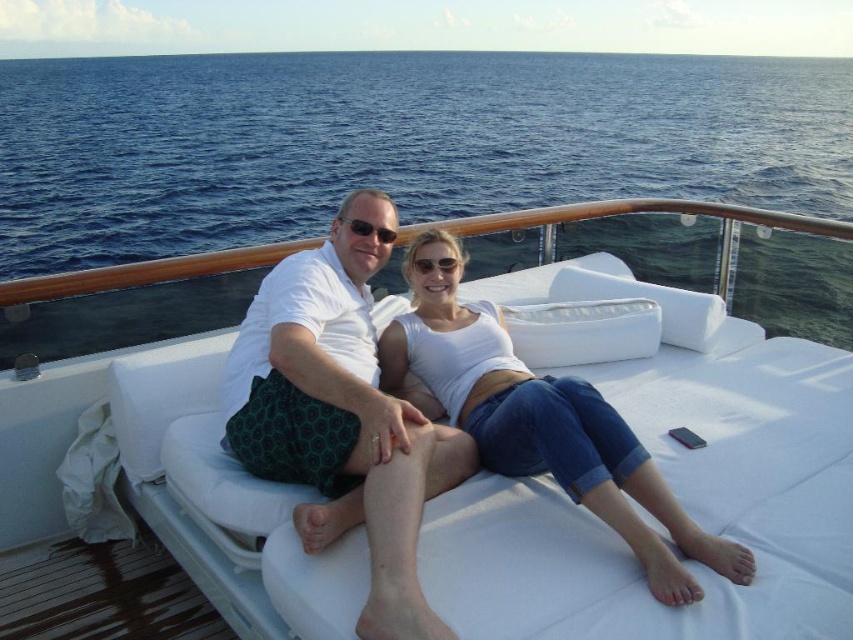
You are standing on the deck of the yacht and want to sit down. There is a point marked at coordinates (670, 483). What object is located at that point?

The point at coordinates (670, 483) corresponds to the white cushioned couch at center.

You are a photographer trying to capture a group photo of the two people on the yacht deck. You want to ensure that both the white cushioned couch at center and the white cotton tank top at center are fully visible in the frame. Given that your camera has a maximum horizontal field of view of 1.2 meters, can you fit both objects in the shot without cropping?

The white cushioned couch at center is wider than the white cotton tank top at center. Since the couch is wider, if its width exceeds 1.2 meters, it alone might not fit. However, since the tank top is smaller, but the question is about both being in frame, the critical factor is the couch width. If the couch is wider than 1.2m, both can only fit if their combined width is within 1.2m. But since the couch is larger, and we donot know exact measurements, cannot confirm. Wait the objects description says the c

You are a photographer trying to capture a photo of the two people sitting on the white cushioned couch at center and wearing the white cotton tank top at center. From your current position, which object is closer to you?

The white cushioned couch at center is closer to you because it is in front of the white cotton tank top at center.